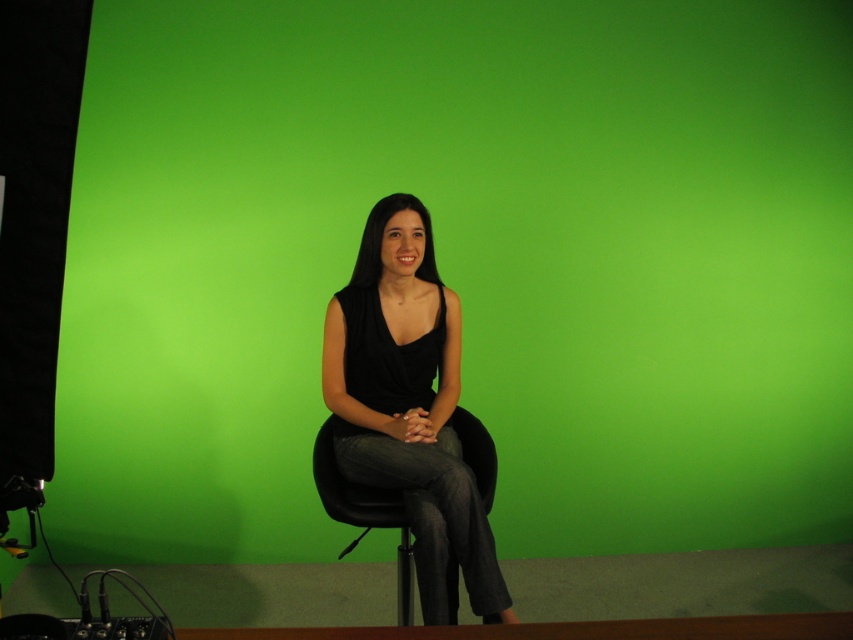
You are standing in front of the black chair in the studio setup. There are two points marked in the scene. Which point is closer to you, point [379,301] or point [403,534]?

Point [403,534] is closer to you because it is in front of point [379,301].